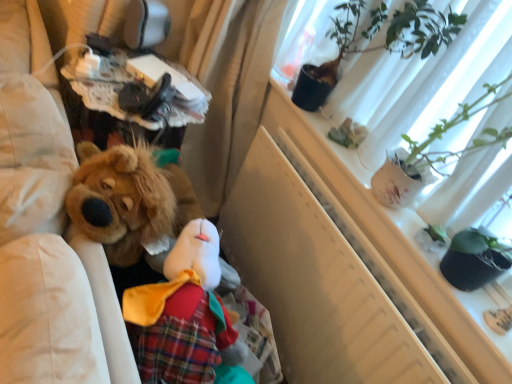
What do you see at coordinates (378, 45) in the screenshot? This screenshot has width=512, height=384. I see `green leafy plant at upper right` at bounding box center [378, 45].

In order to click on green leafy plant at upper right in this screenshot , I will do `click(378, 45)`.

The image size is (512, 384). What do you see at coordinates (424, 81) in the screenshot?
I see `white matte window screen at upper right` at bounding box center [424, 81].

This screenshot has height=384, width=512. What are the coordinates of `white matte window screen at upper right` in the screenshot? It's located at (424, 81).

Identify the location of green leafy plant at upper right. The image size is (512, 384). (378, 45).

Based on their positions, is green leafy plant at upper right located to the left or right of white matte window screen at upper right?

Based on their positions, green leafy plant at upper right is located to the left of white matte window screen at upper right.

Considering the relative positions of green leafy plant at upper right and white matte window screen at upper right in the image provided, is green leafy plant at upper right in front of white matte window screen at upper right?

No, it is behind white matte window screen at upper right.

Which is closer, (404,20) or (478,86)?

Point (404,20) appears to be farther away from the viewer than point (478,86).

From the image's perspective, which is above, green leafy plant at upper right or white matte window screen at upper right?

green leafy plant at upper right.

From a real-world perspective, is green leafy plant at upper right positioned under white matte window screen at upper right based on gravity?

Yes, from a real-world perspective, green leafy plant at upper right is below white matte window screen at upper right.

Considering the sizes of objects green leafy plant at upper right and white matte window screen at upper right in the image provided, who is thinner, green leafy plant at upper right or white matte window screen at upper right?

green leafy plant at upper right.

Who is taller, green leafy plant at upper right or white matte window screen at upper right?

white matte window screen at upper right.

Considering the sizes of green leafy plant at upper right and white matte window screen at upper right in the image, is green leafy plant at upper right bigger or smaller than white matte window screen at upper right?

Considering their sizes, green leafy plant at upper right takes up more space than white matte window screen at upper right.

Is green leafy plant at upper right completely or partially outside of white matte window screen at upper right?

Yes, green leafy plant at upper right is located beyond the bounds of white matte window screen at upper right.

Are green leafy plant at upper right and white matte window screen at upper right far apart?

green leafy plant at upper right is actually quite close to white matte window screen at upper right.

Is green leafy plant at upper right aimed at white matte window screen at upper right?

No, green leafy plant at upper right is not aimed at white matte window screen at upper right.

How different are the orientations of green leafy plant at upper right and white matte window screen at upper right in degrees?

The angle between the facing direction of green leafy plant at upper right and the facing direction of white matte window screen at upper right is 0.00106 degrees.

How far apart are green leafy plant at upper right and white matte window screen at upper right?

green leafy plant at upper right and white matte window screen at upper right are 4.62 inches apart.

The height and width of the screenshot is (384, 512). In order to click on window screen above the green leafy plant at upper right (from a real-world perspective) in this screenshot , I will do `click(424, 81)`.

Which object is positioned more to the left, white matte window screen at upper right or green leafy plant at upper right?

green leafy plant at upper right is more to the left.

Which object is closer to the camera, white matte window screen at upper right or green leafy plant at upper right?

white matte window screen at upper right is closer to the camera.

Between point (367, 136) and point (426, 4), which one is positioned behind?

The point (367, 136) is more distant.

From the image's perspective, is white matte window screen at upper right located above green leafy plant at upper right?

No, from the image's perspective, white matte window screen at upper right is not above green leafy plant at upper right.

From a real-world perspective, who is located higher, white matte window screen at upper right or green leafy plant at upper right?

In real-world perspective, white matte window screen at upper right is above.

Looking at their sizes, would you say white matte window screen at upper right is wider or thinner than green leafy plant at upper right?

Considering their sizes, white matte window screen at upper right looks broader than green leafy plant at upper right.

Between white matte window screen at upper right and green leafy plant at upper right, which one has less height?

Standing shorter between the two is green leafy plant at upper right.

Who is bigger, white matte window screen at upper right or green leafy plant at upper right?

Bigger between the two is green leafy plant at upper right.

Is white matte window screen at upper right situated inside green leafy plant at upper right or outside?

white matte window screen at upper right is located beyond the bounds of green leafy plant at upper right.

Is white matte window screen at upper right touching green leafy plant at upper right?

There is a gap between white matte window screen at upper right and green leafy plant at upper right.

Does white matte window screen at upper right turn towards green leafy plant at upper right?

No.

How many degrees apart are the facing directions of white matte window screen at upper right and green leafy plant at upper right?

They differ by 0.00106 degrees in their facing directions.

You are a GUI agent. You are given a task and a screenshot of the screen. Output one action in this format:
    pyautogui.click(x=<x>, y=<y>)
    Task: Click on the houseplant above the white matte window screen at upper right (from the image's perspective)
    This screenshot has height=384, width=512.
    Given the screenshot: What is the action you would take?
    pyautogui.click(x=378, y=45)

In order to click on houseplant below the white matte window screen at upper right (from a real-world perspective) in this screenshot , I will do `click(378, 45)`.

Locate an element on the screen. The image size is (512, 384). window screen lying in front of the green leafy plant at upper right is located at coordinates (424, 81).